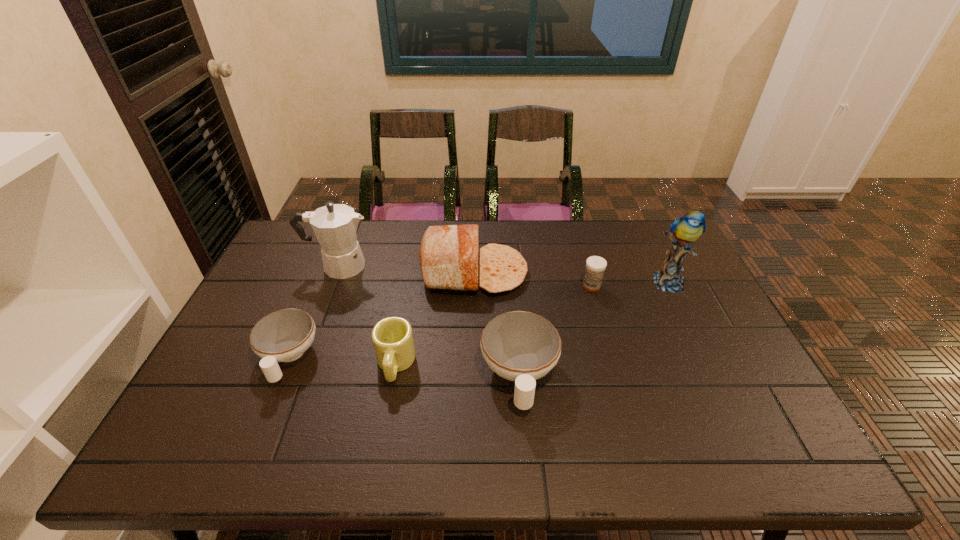
Image resolution: width=960 pixels, height=540 pixels. I want to click on free space located at the sliced end of the bread, so click(633, 272).

Identify the location of vacant area located on the front of the sixth object from left to right. (621, 389).

At what (x,y) coordinates should I click in order to perform the action: click on free spot located on the face of the parrot. Please return your answer as a coordinate pair (x, y). The image size is (960, 540). Looking at the image, I should click on (697, 341).

Image resolution: width=960 pixels, height=540 pixels. I want to click on coffeepot that is positioned at the far edge, so click(x=335, y=225).

This screenshot has height=540, width=960. Identify the location of bread present at the far edge. (448, 256).

The width and height of the screenshot is (960, 540). What are the coordinates of `chinaware that is at the left edge` in the screenshot? It's located at (282, 336).

Identify the location of coffeepot located in the left edge section of the desktop. Image resolution: width=960 pixels, height=540 pixels. (335, 225).

The width and height of the screenshot is (960, 540). Identify the location of object situated at the right edge. (684, 230).

Image resolution: width=960 pixels, height=540 pixels. Find the location of `object that is at the far left corner`. object that is at the far left corner is located at coordinates (335, 225).

I want to click on object present at the near left corner, so click(282, 336).